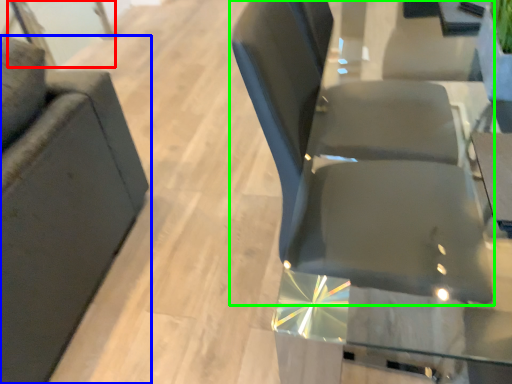
Question: Which is nearer to the glass door (highlighted by a red box)? chair (highlighted by a blue box) or chair (highlighted by a green box).

Choices:
 (A) chair
 (B) chair

Answer: (A)